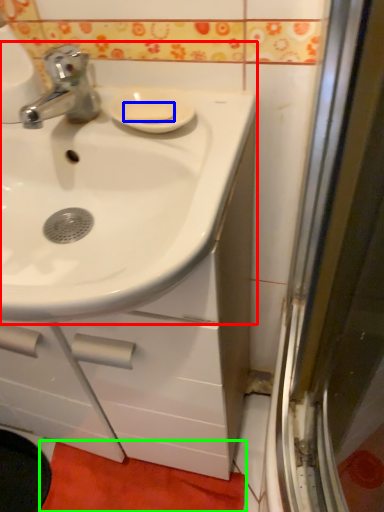
Question: Based on their relative distances, which object is farther from sink (highlighted by a red box)? Choose from soap (highlighted by a blue box) and bath mat (highlighted by a green box).

Choices:
 (A) soap
 (B) bath mat

Answer: (B)